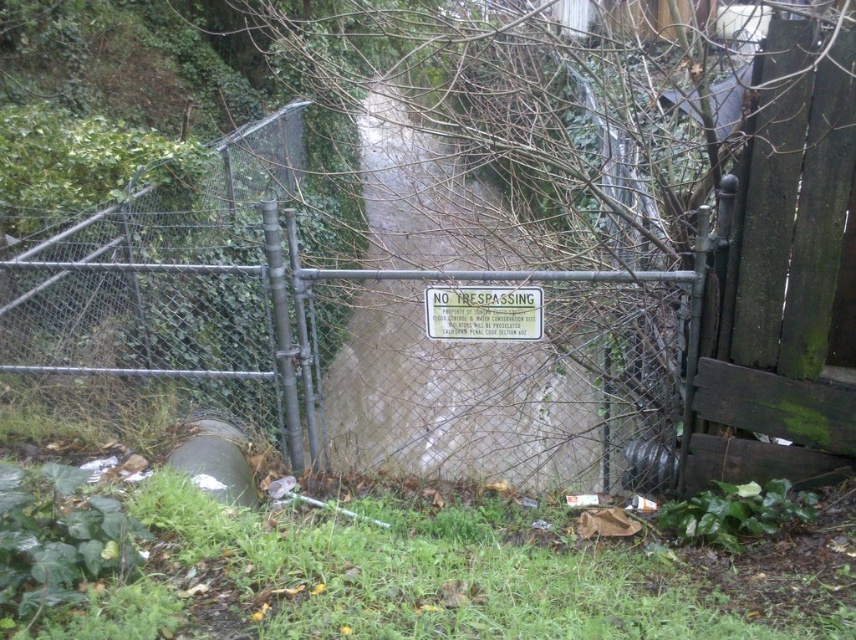
You are standing outside the fenced area and want to see the metallic silver sign at center clearly. Which direction should you look relative to the green grass at lower center?

The metallic silver sign at center is above the green grass at lower center, so you should look upward from the green grass at lower center to see it clearly.